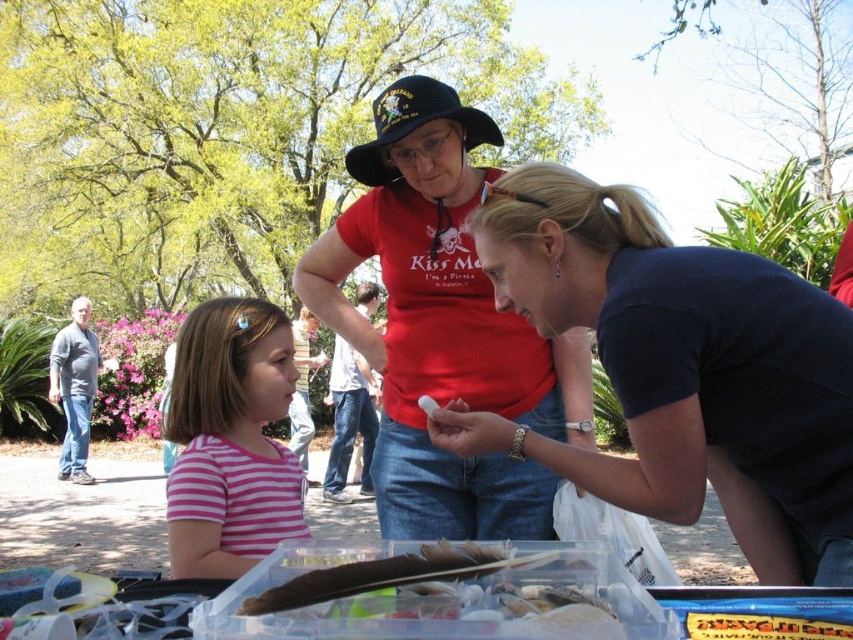
You are a photographer trying to capture a candid shot of the dark blue shirt at center and the black fabric baseball hat at center. Since you want to ensure both are clearly visible, you need to know which one is wider. Which object has a greater width?

The dark blue shirt at center has a greater width than the black fabric baseball hat at center.

You are standing at the point labeled point (404, 104) and want to walk to the point labeled point (477, 333). Which direction should you face to walk directly towards your destination?

You should face backwards because point (477, 333) is behind point (404, 104).